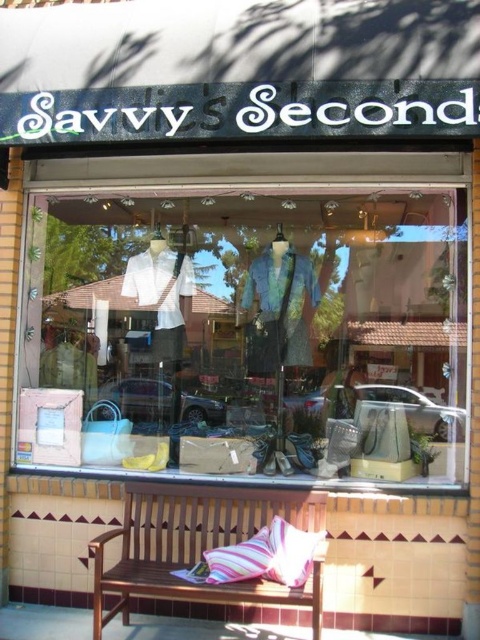
Which of these two, brown wooden bench at center or striped fabric pillow at center, stands taller?

With more height is brown wooden bench at center.

Is brown wooden bench at center behind striped fabric pillow at center?

No, it is in front of striped fabric pillow at center.

Which is in front, point (261, 580) or point (302, 582)?

Point (302, 582) is in front.

This screenshot has width=480, height=640. What are the coordinates of `brown wooden bench at center` in the screenshot? It's located at (200, 545).

Does striped fabric pillow at center have a lesser width compared to pink striped pillow at lower center?

Yes, striped fabric pillow at center is thinner than pink striped pillow at lower center.

Between striped fabric pillow at center and pink striped pillow at lower center, which one appears on the right side from the viewer's perspective?

From the viewer's perspective, striped fabric pillow at center appears more on the right side.

Where is `striped fabric pillow at center`? striped fabric pillow at center is located at coordinates (290, 552).

Where is `striped fabric pillow at center`? striped fabric pillow at center is located at coordinates (290, 552).

Does matte glass display at center have a greater width compared to brown wooden bench at center?

Yes, matte glass display at center is wider than brown wooden bench at center.

Describe the element at coordinates (248, 333) in the screenshot. I see `matte glass display at center` at that location.

Locate an element on the screen. matte glass display at center is located at coordinates pos(248,333).